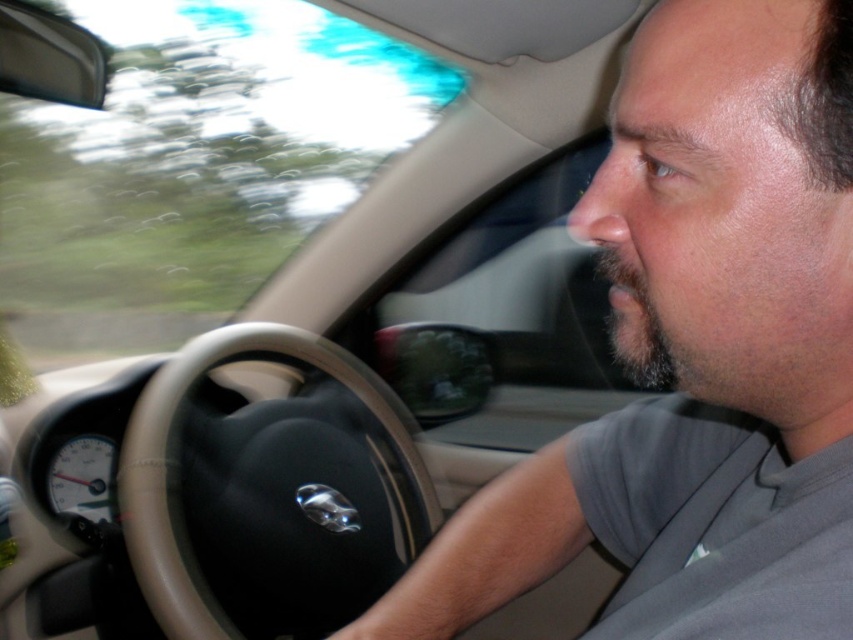
Question: Is gray fabric shirt at center thinner than black leather steering wheel at center?

Choices:
 (A) yes
 (B) no

Answer: (A)

Question: Among these points, which one is farthest from the camera?

Choices:
 (A) (834, 348)
 (B) (329, 593)

Answer: (B)

Question: Considering the relative positions of gray fabric shirt at center and black leather steering wheel at center in the image provided, where is gray fabric shirt at center located with respect to black leather steering wheel at center?

Choices:
 (A) left
 (B) right

Answer: (B)

Question: Is gray fabric shirt at center smaller than black leather steering wheel at center?

Choices:
 (A) no
 (B) yes

Answer: (B)